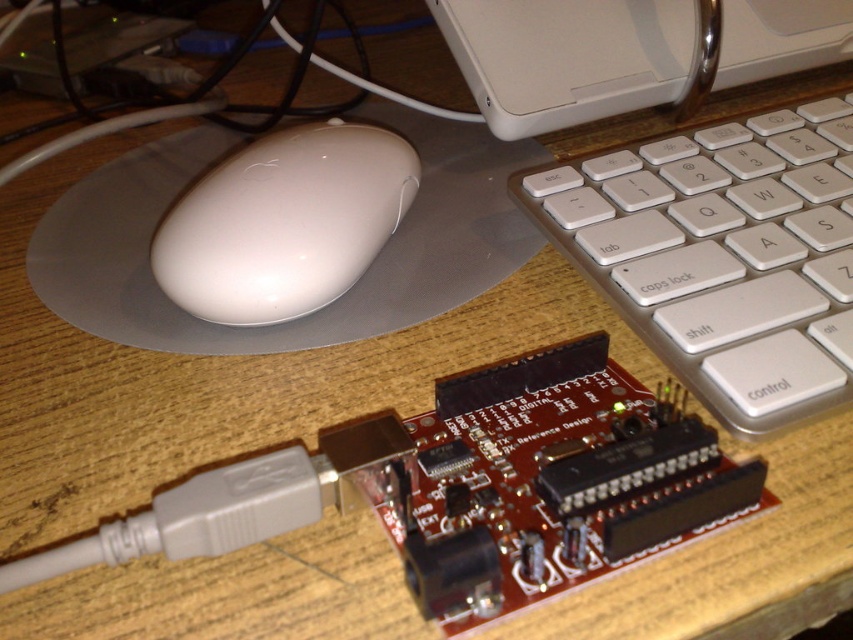
Question: Does white glossy mouse at center appear over white plastic computer at upper center?

Choices:
 (A) no
 (B) yes

Answer: (A)

Question: Among these objects, which one is farthest from the camera?

Choices:
 (A) white glossy mouse at center
 (B) white plastic keyboard at center
 (C) white plastic computer at upper center

Answer: (C)

Question: Does white plastic keyboard at center appear under white plastic computer at upper center?

Choices:
 (A) no
 (B) yes

Answer: (B)

Question: Does white plastic keyboard at center appear on the left side of white plastic computer at upper center?

Choices:
 (A) yes
 (B) no

Answer: (A)

Question: Considering the real-world distances, which object is farthest from the white plastic keyboard at center?

Choices:
 (A) white plastic computer at upper center
 (B) white glossy mouse at center

Answer: (B)

Question: Which of these objects is positioned closest to the white plastic computer at upper center?

Choices:
 (A) white glossy mouse at center
 (B) white plastic keyboard at center

Answer: (B)